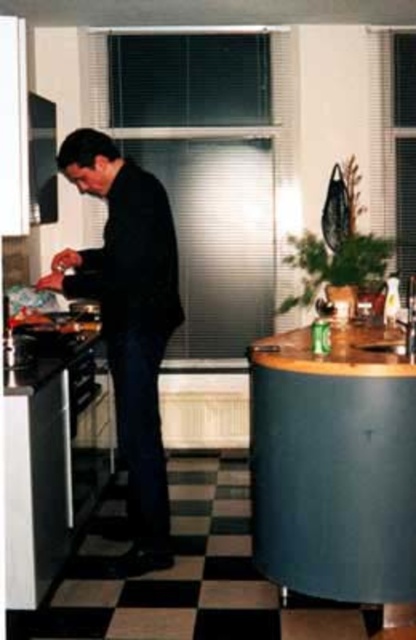
Can you confirm if black matte suit at center is wider than brown wood counter at right?

Incorrect, black matte suit at center's width does not surpass brown wood counter at right's.

Does point (111, 157) lie in front of point (354, 333)?

That is True.

Between point (158, 435) and point (294, 337), which one is positioned in front?

Point (158, 435)

Locate an element on the screen. black matte suit at center is located at coordinates (128, 321).

Is wooden laminate counter at right thinner than black matte suit at center?

In fact, wooden laminate counter at right might be wider than black matte suit at center.

Is wooden laminate counter at right to the left of black matte suit at center from the viewer's perspective?

In fact, wooden laminate counter at right is to the right of black matte suit at center.

Locate an element on the screen. This screenshot has width=416, height=640. wooden laminate counter at right is located at coordinates (334, 465).

Locate an element on the screen. wooden laminate counter at right is located at coordinates (334, 465).

Does wooden laminate counter at right have a smaller size compared to brown wood counter at right?

Incorrect, wooden laminate counter at right is not smaller in size than brown wood counter at right.

Measure the distance between wooden laminate counter at right and camera.

wooden laminate counter at right and camera are 3.02 meters apart from each other.

I want to click on wooden laminate counter at right, so click(x=334, y=465).